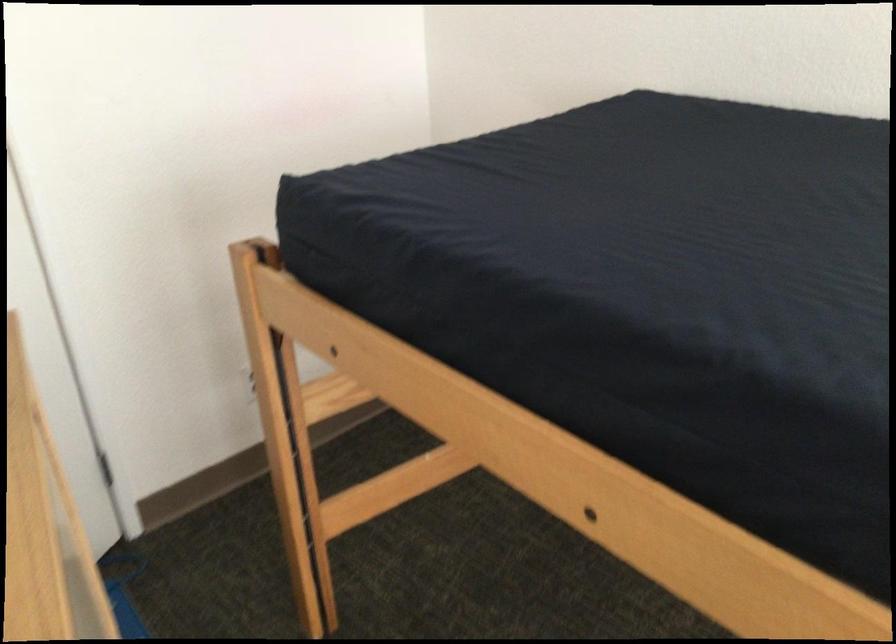
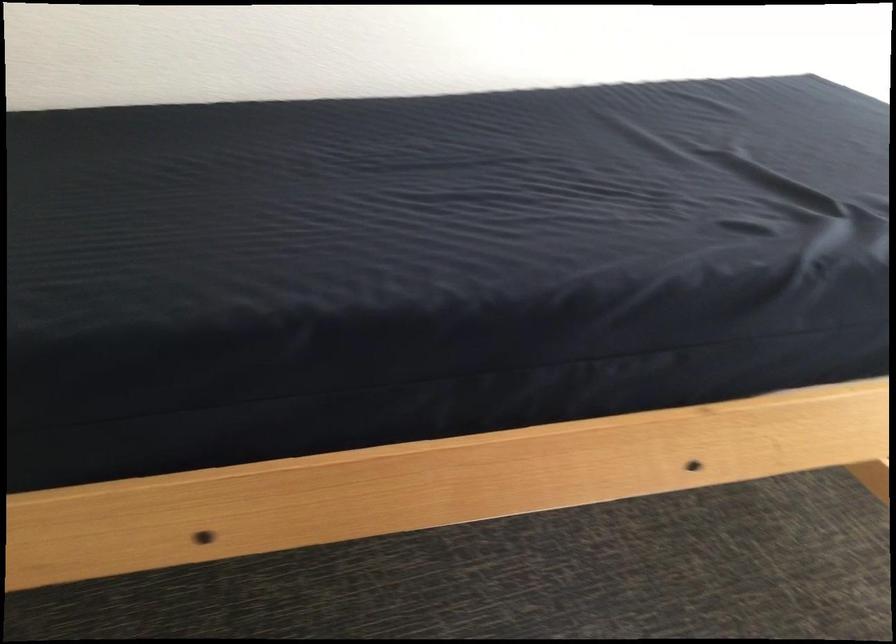
Question: How did the camera likely rotate?

Choices:
 (A) Left
 (B) Right
 (C) Up
 (D) Down

Answer: (B)